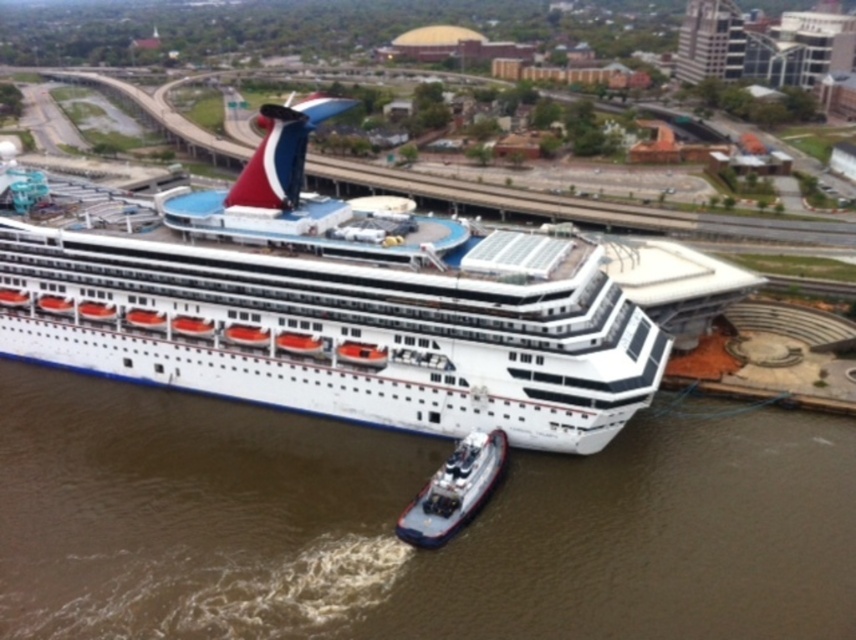
You are a passenger on the cruise ship and want to locate the tugboat from your current position. Based on the scene, which direction should you look to see the metallic gray tugboat at lower center relative to the white glossy cruise ship at center?

The white glossy cruise ship at center is positioned over the metallic gray tugboat at lower center, so you should look downward or below the cruise ship to see the tugboat.

You are standing at point 0.5, 0.4. Which direction should you move to reach the white glossy cruise ship at center?

Since you are at point (342, 320) and the white glossy cruise ship at center is at point (328, 307), you should move slightly to the left and down to reach it.

What is the relationship in width between the white glossy cruise ship at center and the metallic gray tugboat at lower center?

The white glossy cruise ship at center is wider than the metallic gray tugboat at lower center.